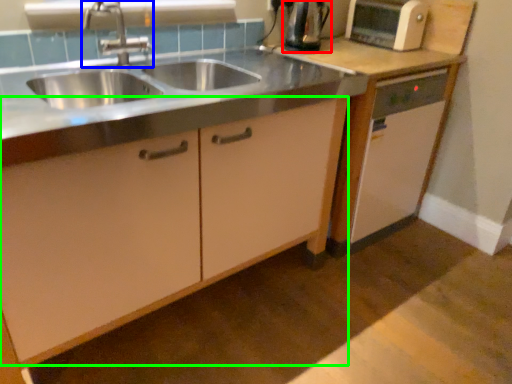
Question: Which object is positioned closest to kitchen appliance (highlighted by a red box)? Select from tap (highlighted by a blue box) and cabinetry (highlighted by a green box).

Choices:
 (A) tap
 (B) cabinetry

Answer: (A)